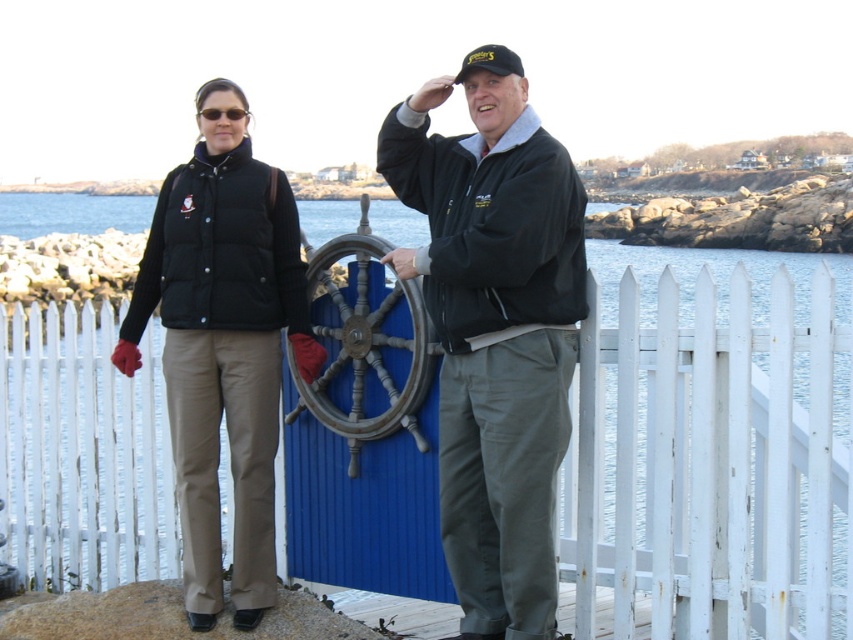
Question: Is matte black jacket at center closer to the viewer compared to wooden ship wheel at center?

Choices:
 (A) yes
 (B) no

Answer: (A)

Question: Which of the following is the closest to the observer?

Choices:
 (A) white picket fence at center
 (B) black puffer vest at left
 (C) matte black vest at center
 (D) matte black jacket at center

Answer: (A)

Question: Which point is farther to the camera?

Choices:
 (A) (434, 305)
 (B) (486, 333)
 (C) (412, 419)

Answer: (C)

Question: Based on their relative distances, which object is farther from the black puffer vest at left?

Choices:
 (A) matte black jacket at center
 (B) matte black vest at center
 (C) white picket fence at center
 (D) black plastic sunglasses at upper center

Answer: (C)

Question: Does white picket fence at center appear over matte black vest at center?

Choices:
 (A) yes
 (B) no

Answer: (A)

Question: Does matte black vest at center appear over wooden ship wheel at center?

Choices:
 (A) yes
 (B) no

Answer: (B)